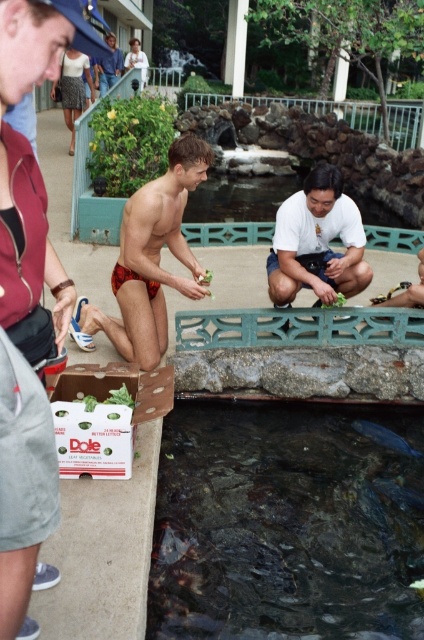
You are standing at the concrete ledge where the man in red swim trunks is feeding fish with lettuce. You want to move to the position where the box labeled Dole Leaf Vegetables is located. Which direction should you walk relative to the point labeled point (332,264) and point (398,440)?

Since point (332,264) is in front of point (398,440), you should walk towards point (398,440) to reach the box labeled Dole Leaf Vegetables.